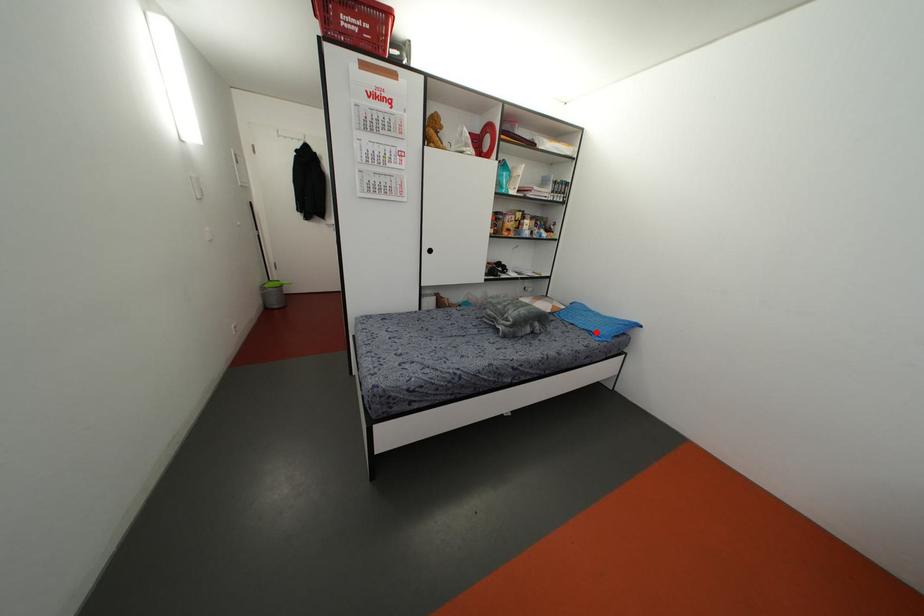
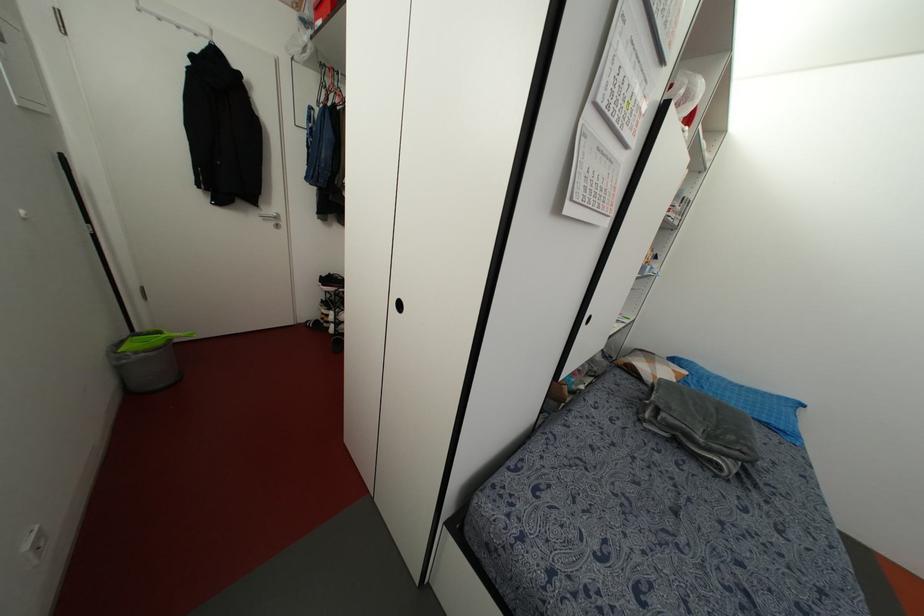
The point at the highlighted location is marked in the first image. Where is the corresponding point in the second image?

(782, 427)